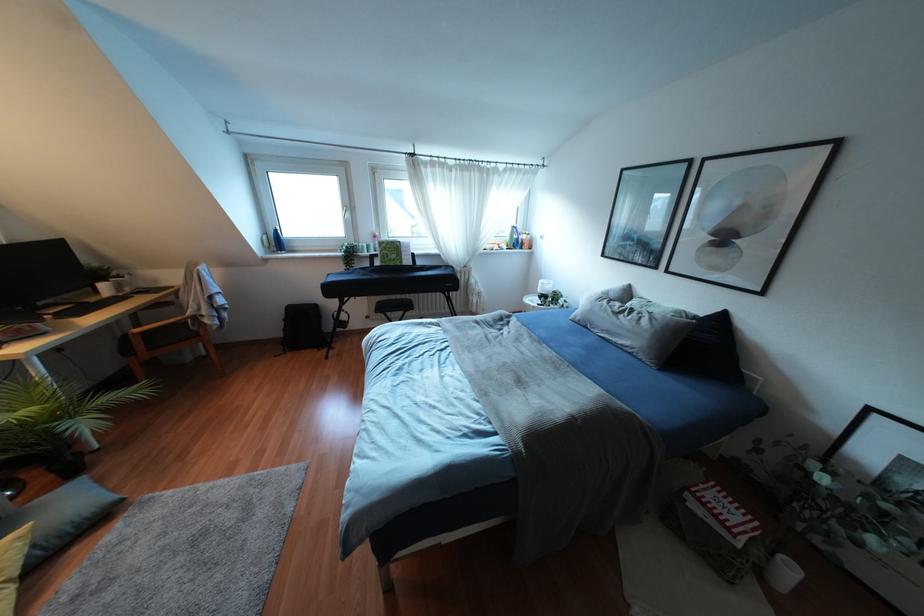
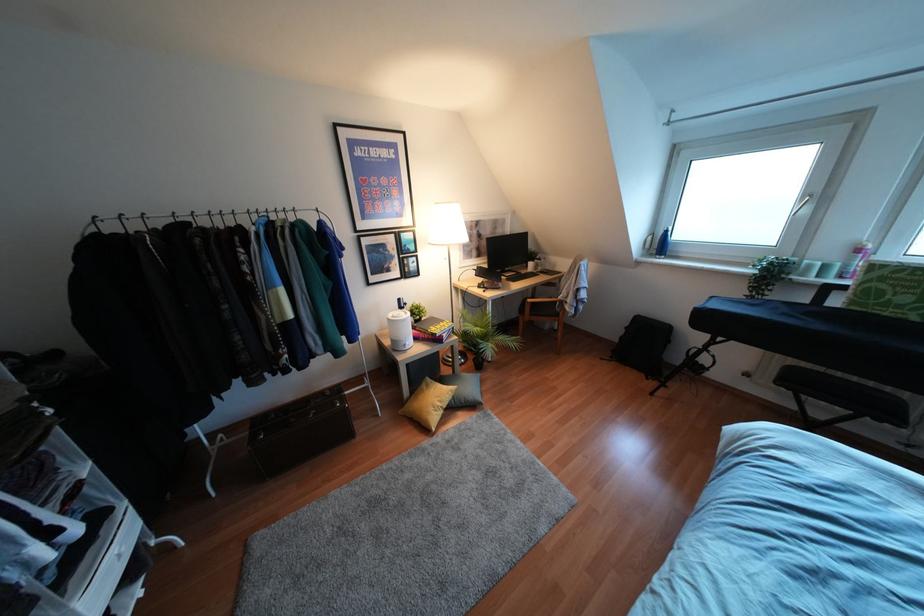
Locate, in the second image, the point that corresponds to point (275, 241) in the first image.

(660, 245)